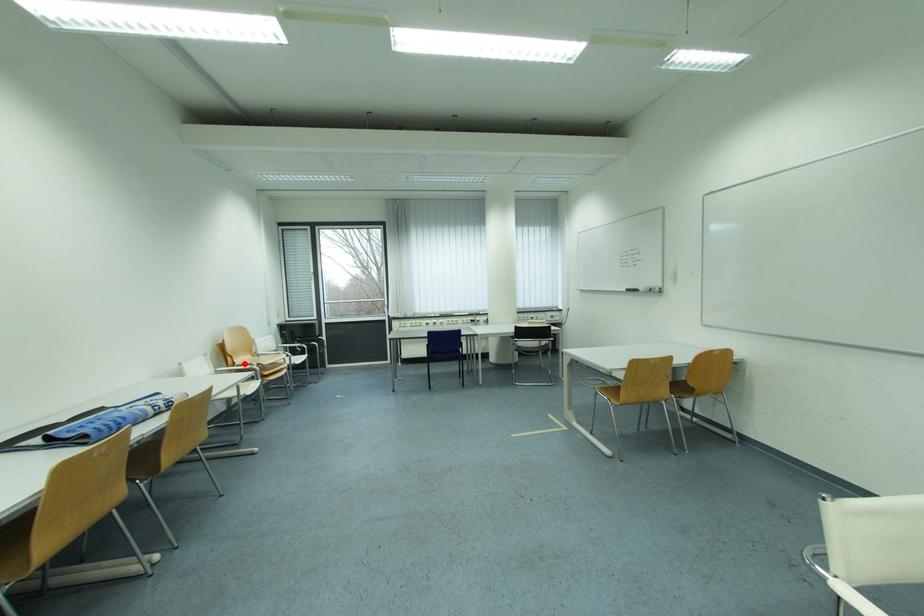
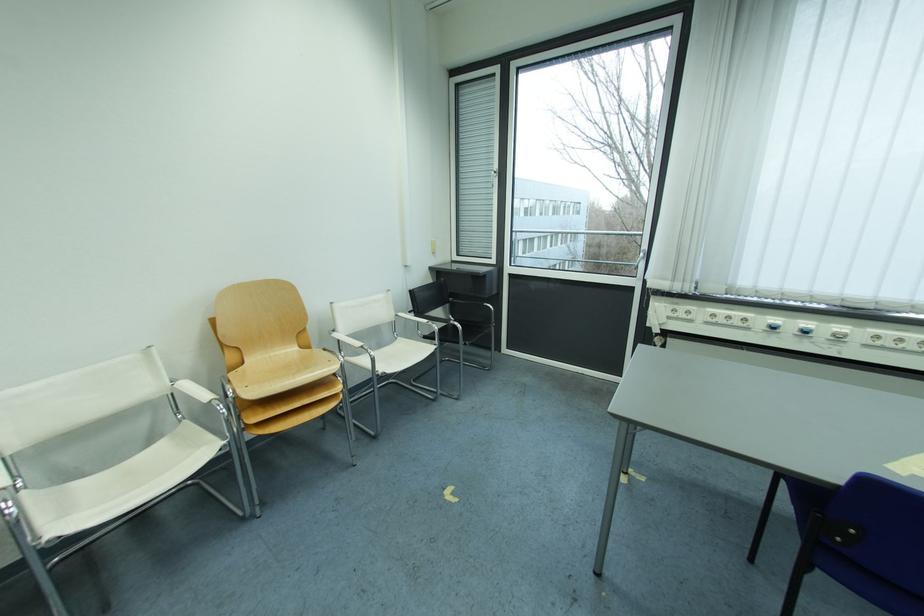
Where in the second image is the point corresponding to the highlighted location from the first image?

(254, 363)